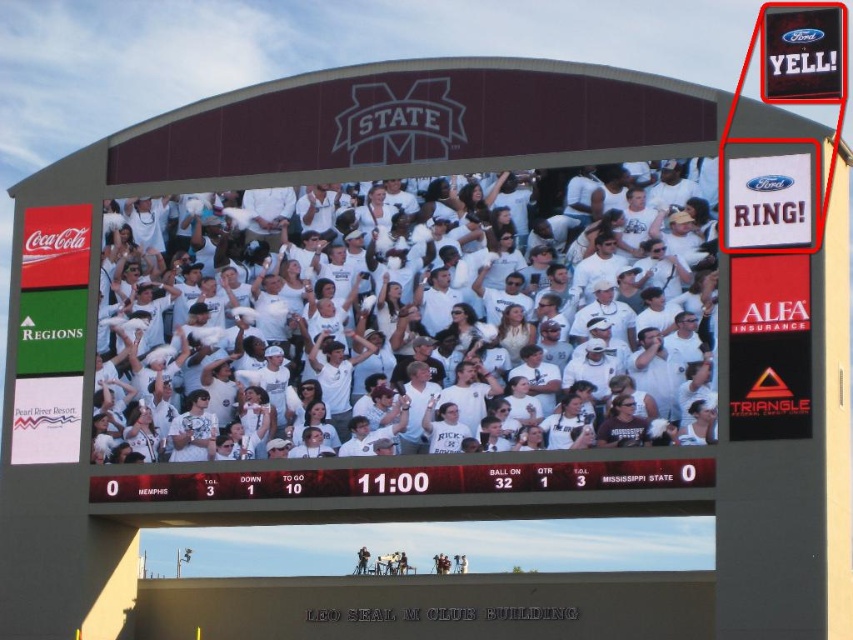
You are a photographer standing in the stadium and want to capture both the white plastic scoreboard at center and the red plastic sign at upper right in a single photo. Considering their heights, which object should you focus on first to ensure both are fully visible in your shot?

The white plastic scoreboard at center has a lesser height compared to the red plastic sign at upper right. To ensure both are fully visible, focus on the taller red plastic sign at upper right first, then adjust the camera angle to include the shorter white plastic scoreboard at center.

You are a spectator at the game and want to locate both the white plastic scoreboard at center and the red plastic sign at upper right. According to the scene, which object is positioned to the left of the other?

The white plastic scoreboard at center is to the left of the red plastic sign at upper right.